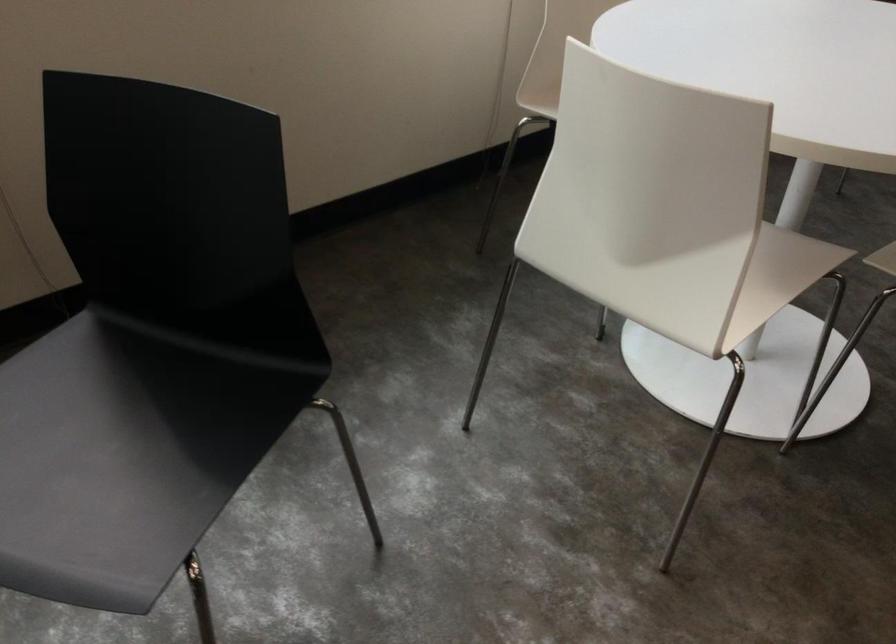
You are a GUI agent. You are given a task and a screenshot of the screen. Output one action in this format:
    pyautogui.click(x=<x>, y=<y>)
    Task: Click on the black chair sitting surface
    Image resolution: width=896 pixels, height=644 pixels.
    Given the screenshot: What is the action you would take?
    [x=124, y=459]